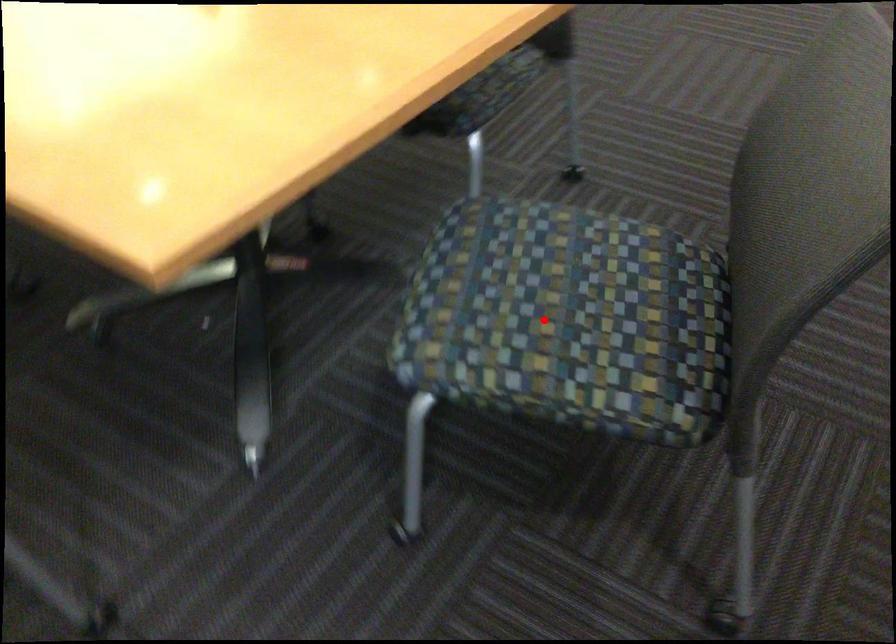
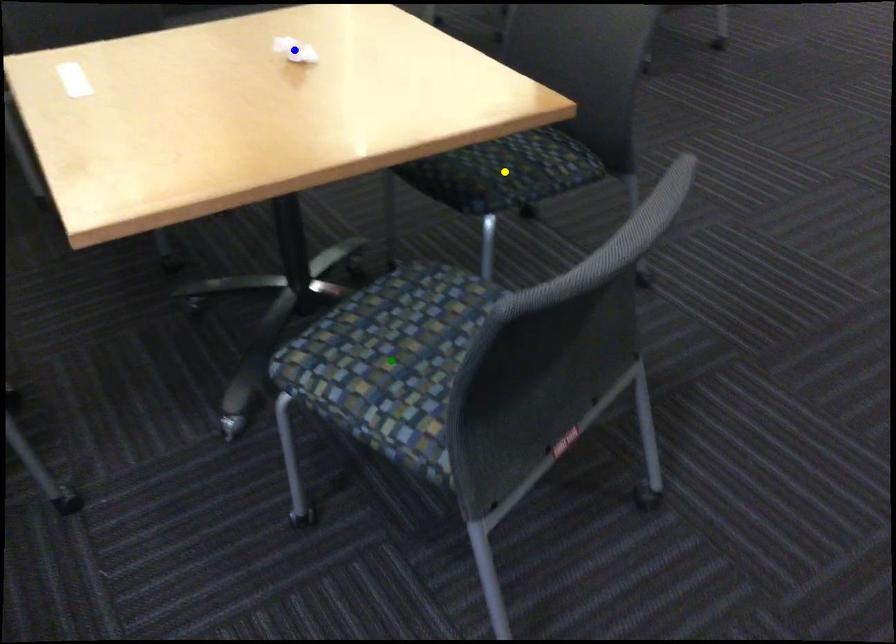
Question: I am providing you with two images of the same scene from different viewpoints. A red point is marked on the first image. You are given multiple points on the second image. Which point in image 2 is actually the same real-world point as the red point in image 1?

Choices:
 (A) yellow point
 (B) green point
 (C) blue point

Answer: (B)